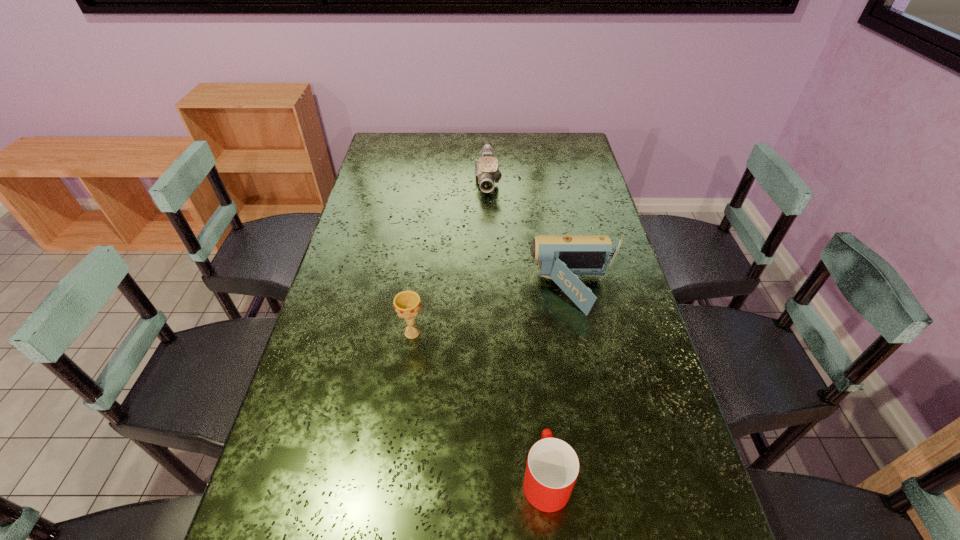
Find the location of a particular element. The width and height of the screenshot is (960, 540). free space located 0.170m on the side of the right camcorder with the flip-out screen is located at coordinates (471, 292).

Where is `vacant space located on the front of the third farthest object`? The width and height of the screenshot is (960, 540). vacant space located on the front of the third farthest object is located at coordinates (394, 470).

What are the coordinates of `vacant space located on the side of the nearest object with the handle` in the screenshot? It's located at (530, 319).

Locate an element on the screen. The image size is (960, 540). vacant region located 0.140m on the side of the nearest object with the handle is located at coordinates point(537,389).

Find the location of `vacant space positioned on the side of the nearest object with the handle`. vacant space positioned on the side of the nearest object with the handle is located at coordinates (537, 386).

I want to click on object positioned at the right edge, so click(561, 258).

Where is `free space at the far edge`? The width and height of the screenshot is (960, 540). free space at the far edge is located at coordinates (526, 157).

Find the location of a particular element. vacant space at the left edge of the desktop is located at coordinates (360, 379).

Locate an element on the screen. This screenshot has width=960, height=540. vacant space at the right edge is located at coordinates (577, 229).

In the image, there is a desktop. At what (x,y) coordinates should I click in order to perform the action: click on vacant region at the far right corner. Please return your answer as a coordinate pair (x, y). This screenshot has width=960, height=540. Looking at the image, I should click on (561, 145).